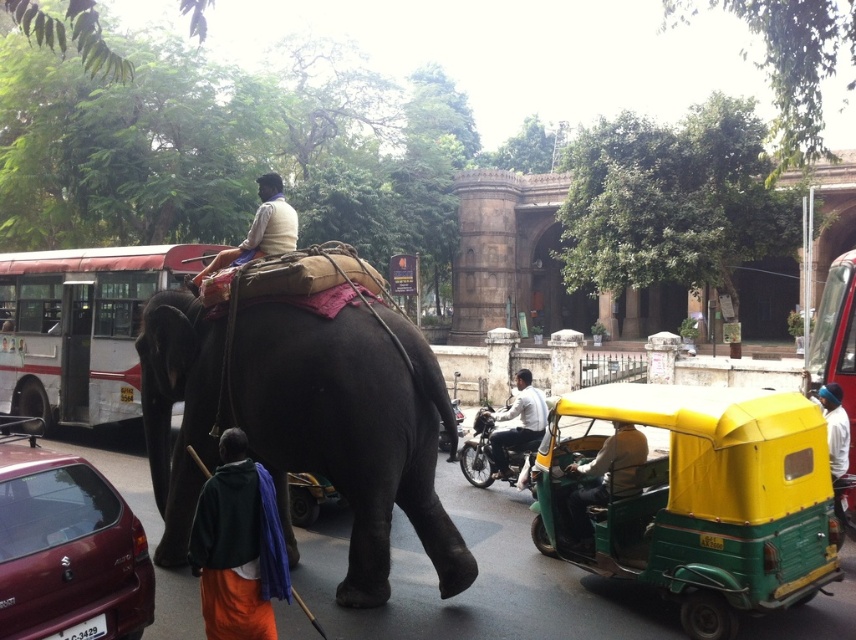
Measure the distance from dark gray elephant at center to green plastic rickshaw at center.

dark gray elephant at center and green plastic rickshaw at center are 2.09 meters apart.

Between point (441, 572) and point (657, 540), which one is positioned behind?

The point (441, 572) is more distant.

Who is more forward, (x=256, y=404) or (x=690, y=518)?

Point (x=690, y=518)

Find the location of a particular element. The image size is (856, 640). dark gray elephant at center is located at coordinates (x=304, y=426).

Does white painted bus at center appear under metallic red bus at right?

Indeed, white painted bus at center is positioned under metallic red bus at right.

Is white painted bus at center positioned behind metallic red bus at right?

Yes, white painted bus at center is further from the viewer.

Is point (62, 340) behind point (815, 353)?

Yes.

At what (x,y) coordinates should I click in order to perform the action: click on white painted bus at center. Please return your answer as a coordinate pair (x, y). Looking at the image, I should click on (81, 326).

Consider the image. Between white painted bus at center and orange cotton dhoti at lower left, which one is positioned higher?

orange cotton dhoti at lower left is above.

Which is in front, point (128, 378) or point (254, 541)?

Point (254, 541) is more forward.

Is point (128, 365) positioned after point (224, 625)?

Yes, point (128, 365) is farther from viewer.

Locate an element on the screen. The width and height of the screenshot is (856, 640). white painted bus at center is located at coordinates (81, 326).